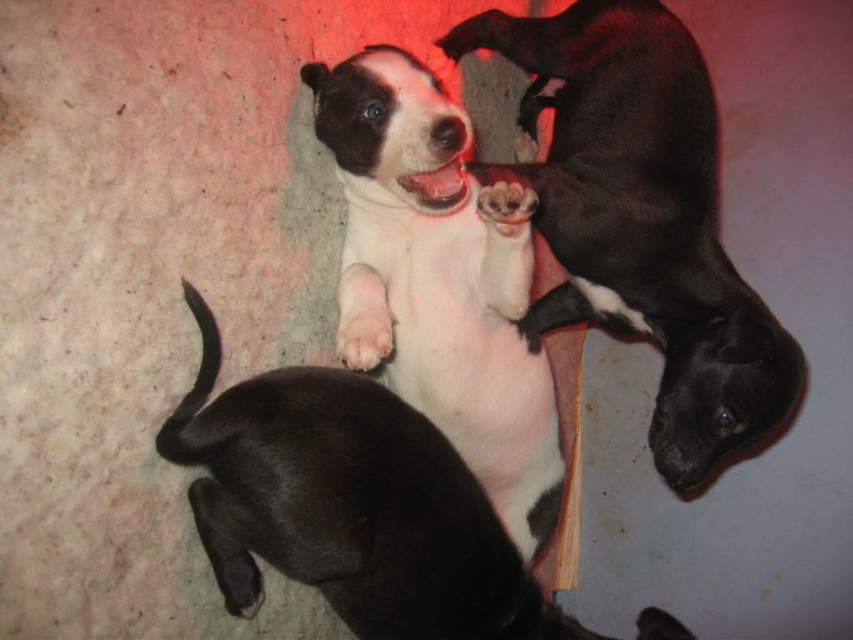
In the image, there are three puppies on a textured surface. The central puppy is white with black markings, and there is a black puppy to its right. A point labeled at coordinates (641, 218) is mentioned. Based on the scene description, can you determine which puppy the point is marking?

The point labeled at coordinates (641, 218) marks the white smooth puppy at center.

You are a photographer trying to capture the white smooth puppy at center in a closeup shot. The camera you are using has a focal length of 85mm and you are currently positioned at point A. To ensure the puppy fills the frame, you need to move closer or further away. Based on the coordinates provided in the scene description, should you move closer to the puppy or move further away?

The white smooth puppy at center is located at coordinates point A. Since the photographer is already at point A, they should not move closer or further away as they are already positioned at the correct distance to capture the puppy in a closeup shot.

You are a photographer trying to capture the white smooth puppy at center and the white matte dog at center in a clear photo. Which one is more likely to reflect light and create glare, making it harder to focus?

The white smooth puppy at center is more likely to reflect light and create glare because it is positioned over the white matte dog at center, which may cause the smooth surface to reflect more light.